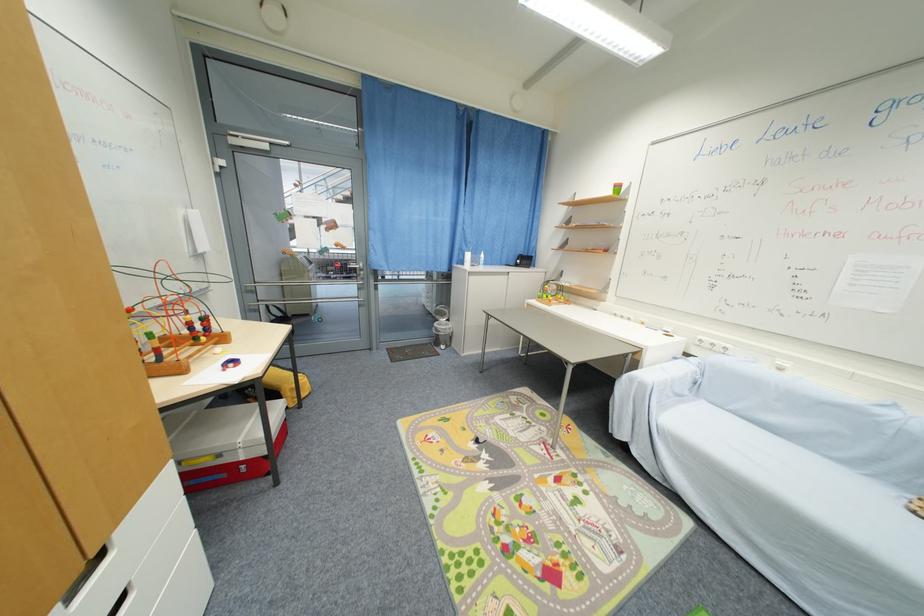
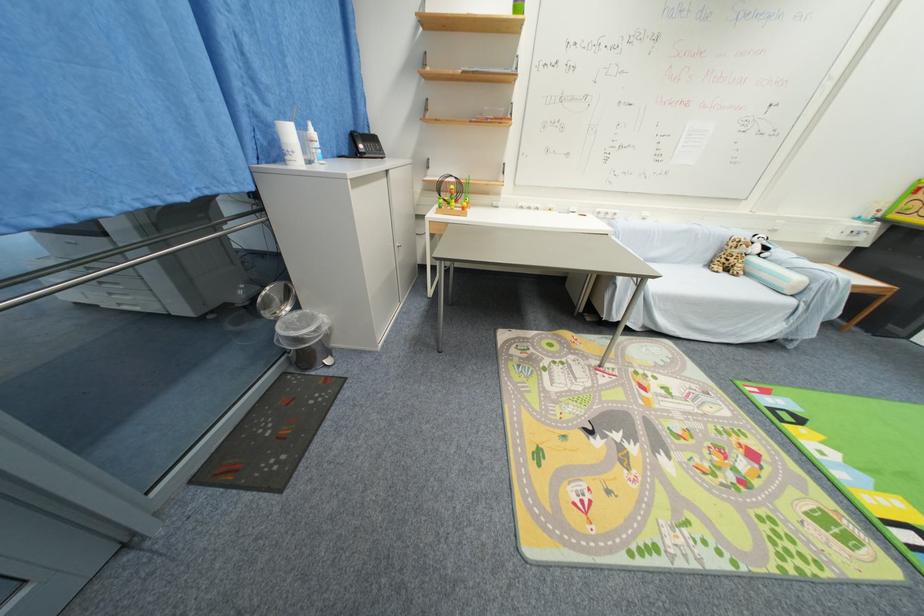
In the second image, find the point that corresponds to [480,256] in the first image.

(306, 129)